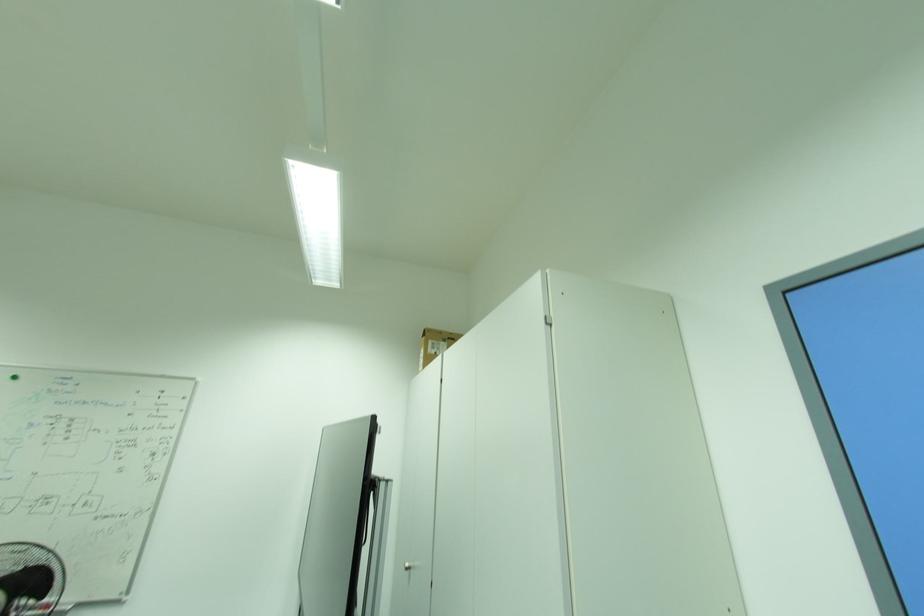
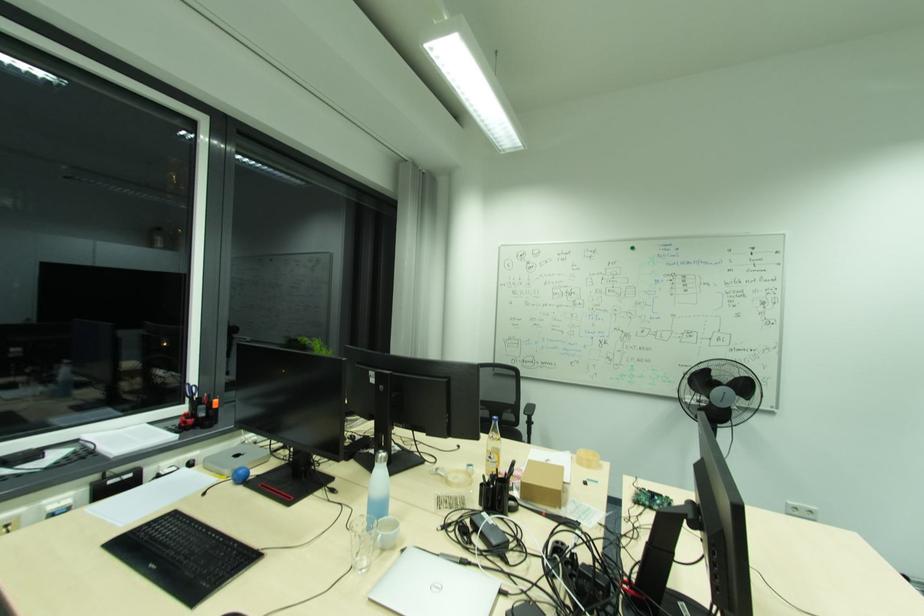
Locate, in the second image, the point that corresponds to the point at 39,582 in the first image.

(748, 387)